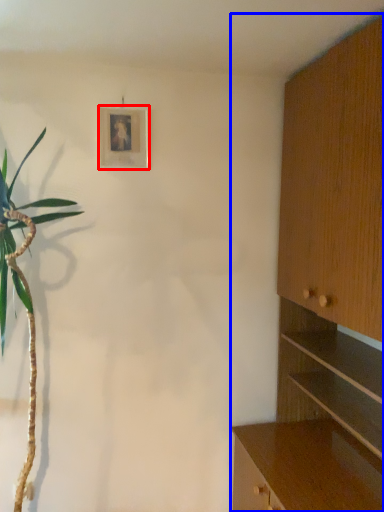
Question: Among these objects, which one is nearest to the camera, picture frame (highlighted by a red box) or cabinetry (highlighted by a blue box)?

Choices:
 (A) picture frame
 (B) cabinetry

Answer: (B)